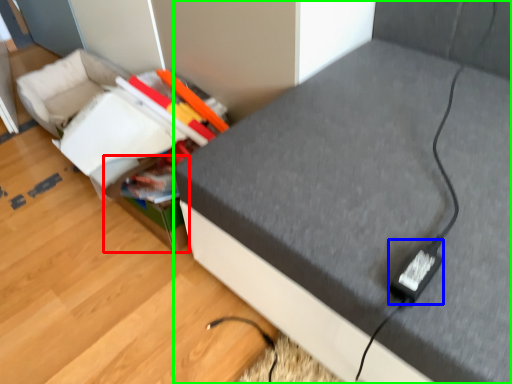
Question: Which object is positioned closest to storage box (highlighted by a red box)? Select from plug (highlighted by a blue box) and furniture (highlighted by a green box).

Choices:
 (A) plug
 (B) furniture

Answer: (B)